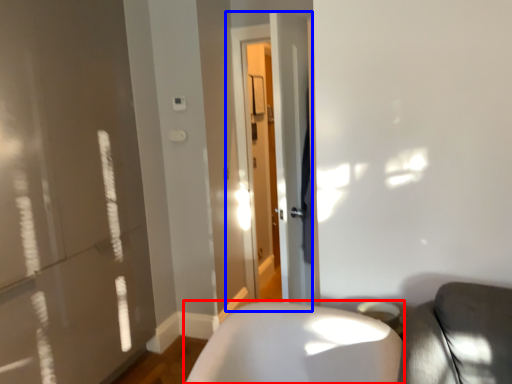
Question: Which point is further to the camera, furniture (highlighted by a red box) or screen door (highlighted by a blue box)?

Choices:
 (A) furniture
 (B) screen door

Answer: (B)